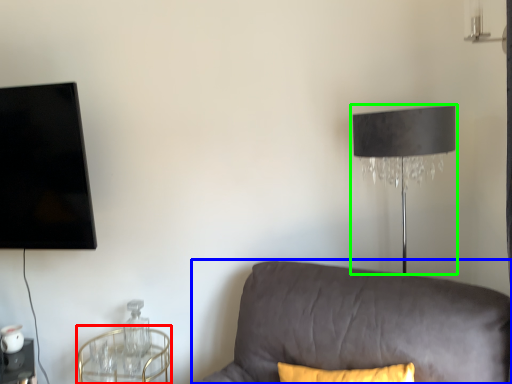
Question: Estimate the real-world distances between objects in this image. Which object is farther from round table (highlighted by a red box), studio couch (highlighted by a blue box) or lamp (highlighted by a green box)?

Choices:
 (A) studio couch
 (B) lamp

Answer: (B)